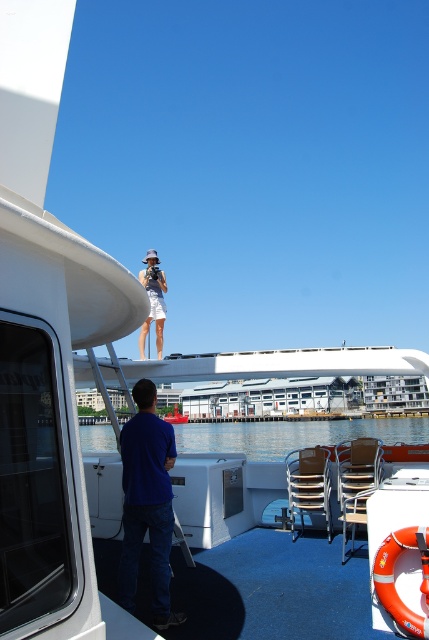
Does blue cotton shirt at lower left appear on the right side of blue water at lower center?

Indeed, blue cotton shirt at lower left is positioned on the right side of blue water at lower center.

Is the position of blue cotton shirt at lower left more distant than that of blue water at lower center?

That is False.

Does point (168, 428) lie in front of point (105, 438)?

Yes, it is in front of point (105, 438).

Locate an element on the screen. The image size is (429, 640). blue cotton shirt at lower left is located at coordinates (147, 502).

Between blue cotton shirt at lower left and light blue plastic boat at center, which one appears on the right side from the viewer's perspective?

blue cotton shirt at lower left

Is blue cotton shirt at lower left wider than light blue plastic boat at center?

No, blue cotton shirt at lower left is not wider than light blue plastic boat at center.

Is point (135, 563) closer to camera compared to point (181, 422)?

Yes, point (135, 563) is closer to viewer.

Find the location of a particular element. blue cotton shirt at lower left is located at coordinates (147, 502).

Does blue cotton shirt at lower left have a smaller size compared to matte white skirt at upper center?

Actually, blue cotton shirt at lower left might be larger than matte white skirt at upper center.

Is point (148, 513) positioned behind point (141, 269)?

No, it is in front of (141, 269).

Is point (154, 586) positioned before point (153, 298)?

Yes, it is in front of point (153, 298).

At what (x,y) coordinates should I click in order to perform the action: click on blue cotton shirt at lower left. Please return your answer as a coordinate pair (x, y). Looking at the image, I should click on (147, 502).